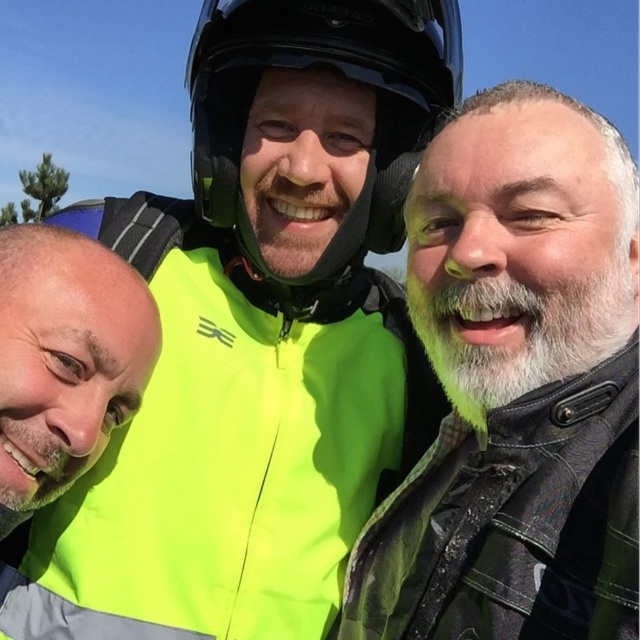
You are a pedestrian trying to cross the road and see the neon yellow jacket at center and the matte black helmet at upper center. Which object is positioned higher in the image?

The neon yellow jacket at center is above matte black helmet at upper center, so the neon yellow jacket at center is positioned higher in the image.